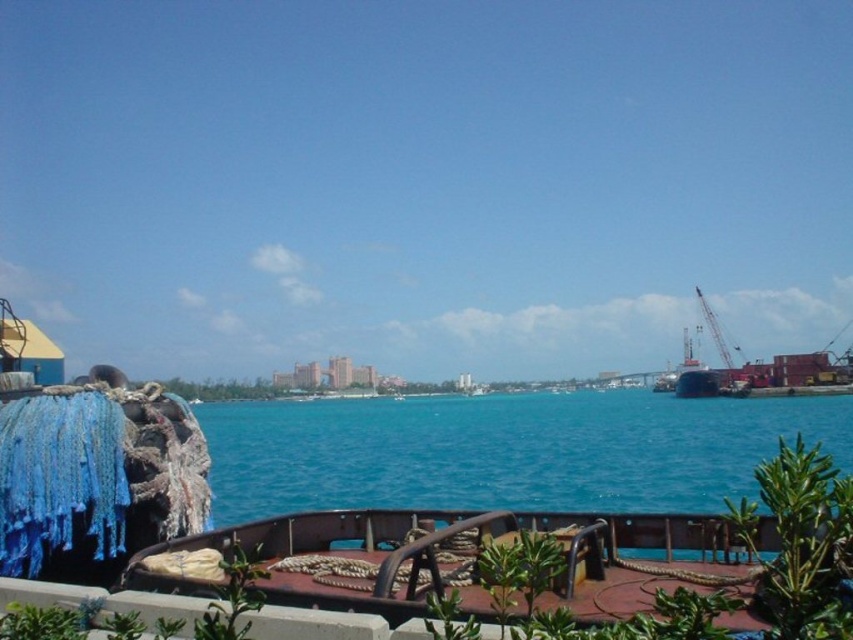
You are a sailor who needs to secure your boat to the dock. You see the blue water at center and the metallic gray crane at right. Which object is located below the other?

The blue water at center is positioned under the metallic gray crane at right, meaning the water is below the crane.

You are a sailor trying to navigate a small boat between the blue water at center and the metallic gray crane at right. Which direction should you steer your boat to avoid hitting the crane?

You should steer your boat towards the blue water at center because it is wider than the metallic gray crane at right, providing more space for safe passage.